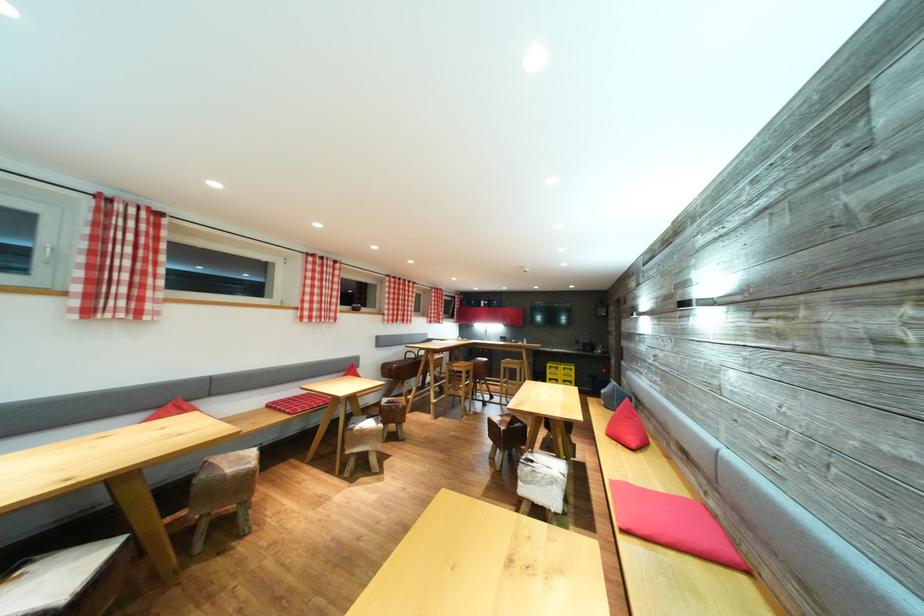
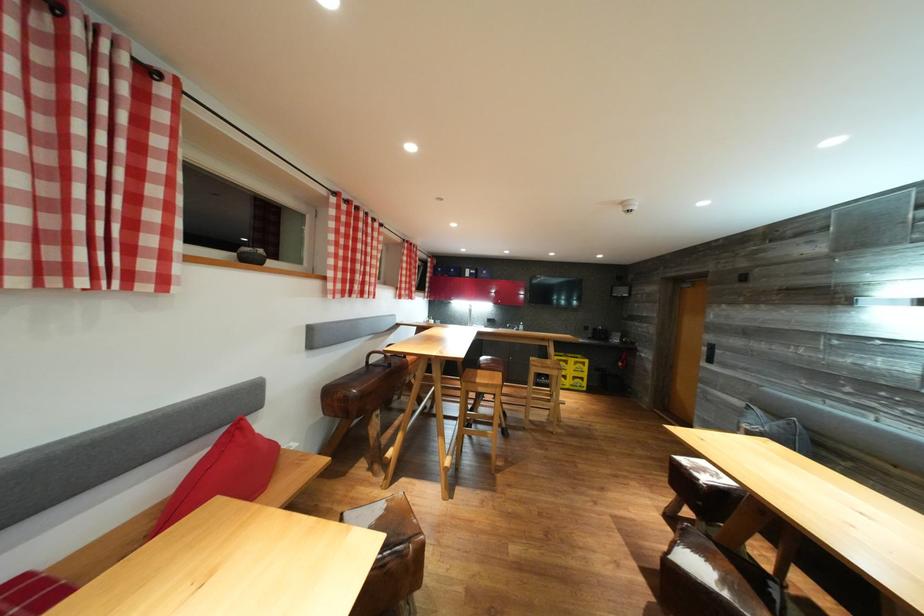
Where in the second image is the point corresponding to pixel 465 371 from the first image?

(492, 391)